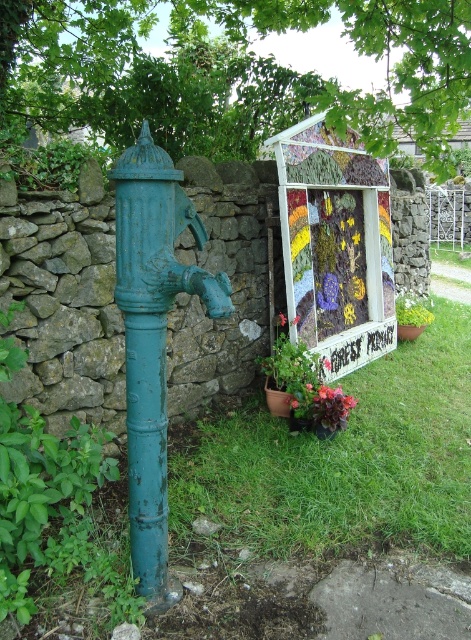
Is green grass at lower center further to the viewer compared to matte red flower at center?

No, it is in front of matte red flower at center.

Between green grass at lower center and matte red flower at center, which one is positioned higher?

Positioned higher is matte red flower at center.

Is point (443, 548) closer to camera compared to point (297, 314)?

Yes, point (443, 548) is in front of point (297, 314).

The width and height of the screenshot is (471, 640). In order to click on green grass at lower center in this screenshot , I will do `click(344, 460)`.

Between green grass at lower center and dark red matte flower at center, which one is positioned lower?

green grass at lower center

Is point (423, 365) in front of point (305, 385)?

No, it is behind (305, 385).

You are a GUI agent. You are given a task and a screenshot of the screen. Output one action in this format:
    pyautogui.click(x=<x>, y=<y>)
    Task: Click on the green grass at lower center
    
    Given the screenshot: What is the action you would take?
    pyautogui.click(x=344, y=460)

Does green grass at lower center have a lesser width compared to matte teal pipe at left?

Incorrect, green grass at lower center's width is not less than matte teal pipe at left's.

Locate an element on the screen. green grass at lower center is located at coordinates (344, 460).